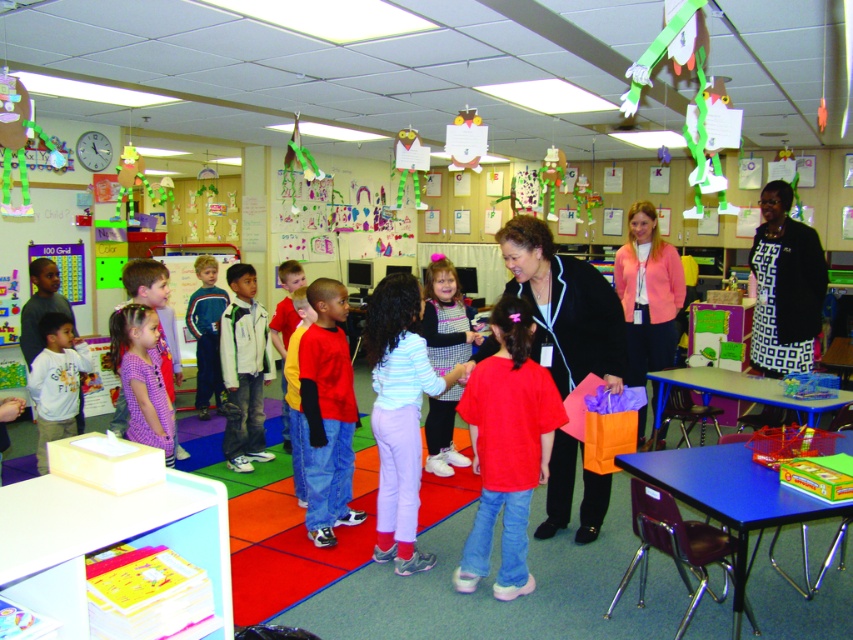
Is point (373, 317) positioned after point (67, 419)?

No, it is not.

Is striped cotton shirt at center closer to the viewer compared to matte gray shirt at left?

Yes, striped cotton shirt at center is in front of matte gray shirt at left.

Does point (381, 518) lie in front of point (80, 340)?

Yes, it is in front of point (80, 340).

The width and height of the screenshot is (853, 640). I want to click on striped cotton shirt at center, so click(x=399, y=416).

Is red/yellow long-sleeve shirt at center below matte black dress at center?

Yes, red/yellow long-sleeve shirt at center is below matte black dress at center.

In the scene shown: Can you confirm if red/yellow long-sleeve shirt at center is wider than matte black dress at center?

Incorrect, red/yellow long-sleeve shirt at center's width does not surpass matte black dress at center's.

At what (x,y) coordinates should I click in order to perform the action: click on red/yellow long-sleeve shirt at center. Please return your answer as a coordinate pair (x, y). Looking at the image, I should click on (328, 412).

Where is `red/yellow long-sleeve shirt at center`? Image resolution: width=853 pixels, height=640 pixels. red/yellow long-sleeve shirt at center is located at coordinates (328, 412).

Measure the distance between green fleece jacket at center and camera.

green fleece jacket at center and camera are 19.66 feet apart.

Can you confirm if green fleece jacket at center is wider than yellow fleece sweater at center?

Yes.

Identify the location of green fleece jacket at center. The width and height of the screenshot is (853, 640). (206, 333).